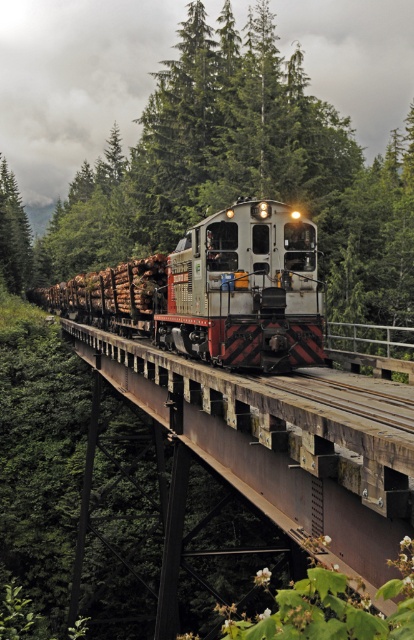
Question: Considering the real-world distances, which object is farthest from the green matte tree at left?

Choices:
 (A) green textured tree at center
 (B) brown wooden train track at center

Answer: (B)

Question: Which object is positioned closest to the rustic wood bridge at center?

Choices:
 (A) green matte tree at left
 (B) metallic silver train at center
 (C) green textured tree at center
 (D) brown wooden train track at center

Answer: (D)

Question: Does brown wooden train track at center have a larger size compared to green matte tree at left?

Choices:
 (A) yes
 (B) no

Answer: (B)

Question: Is rustic wood bridge at center above metallic silver train at center?

Choices:
 (A) yes
 (B) no

Answer: (B)

Question: Which object is positioned closest to the green matte tree at left?

Choices:
 (A) metallic silver train at center
 (B) rustic wood bridge at center

Answer: (A)

Question: Is rustic wood bridge at center smaller than green matte tree at left?

Choices:
 (A) yes
 (B) no

Answer: (A)